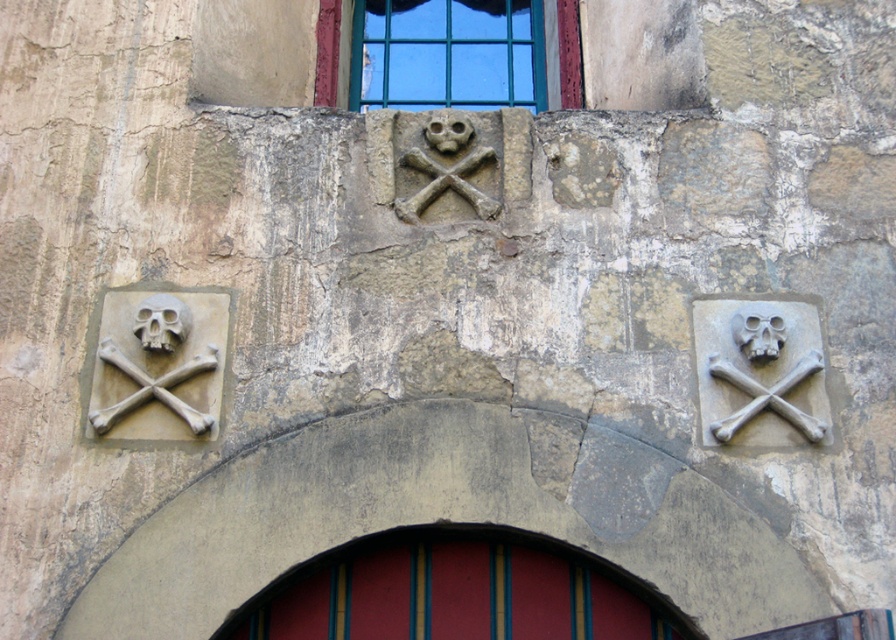
Can you confirm if stone skull and crossbones at center is smaller than matte stone skull at center?

No.

Who is higher up, stone skull and crossbones at center or matte stone skull at center?

matte stone skull at center is above.

Which is in front, point (435, 148) or point (426, 124)?

Point (435, 148) is more forward.

Where is `stone skull and crossbones at center`? This screenshot has width=896, height=640. stone skull and crossbones at center is located at coordinates (445, 172).

Can you confirm if matte stone skull at right is wider than matte stone skull at center?

Yes, matte stone skull at right is wider than matte stone skull at center.

Can you confirm if matte stone skull at right is positioned below matte stone skull at center?

Indeed, matte stone skull at right is positioned under matte stone skull at center.

Between point (739, 337) and point (442, 120), which one is positioned behind?

Point (442, 120)

You are a GUI agent. You are given a task and a screenshot of the screen. Output one action in this format:
    pyautogui.click(x=<x>, y=<y>)
    Task: Click on the matte stone skull at right
    
    Given the screenshot: What is the action you would take?
    pyautogui.click(x=757, y=333)

Is gray stone skull and crossbones at left above matte stone skull at center?

No, gray stone skull and crossbones at left is not above matte stone skull at center.

Is point (96, 408) farther from camera compared to point (454, 132)?

No.

Is point (187, 300) positioned behind point (466, 116)?

That is False.

Identify the location of gray stone skull and crossbones at left. The height and width of the screenshot is (640, 896). (158, 365).